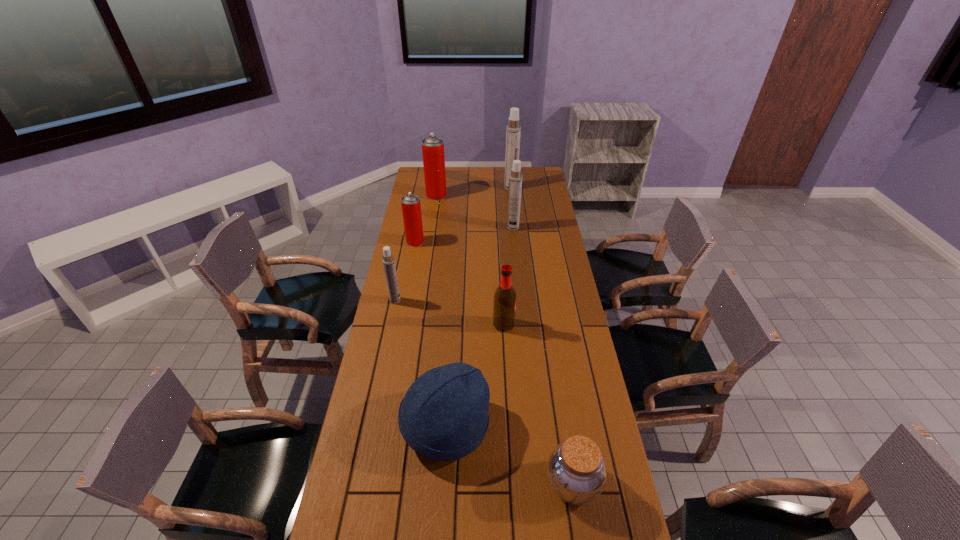
The height and width of the screenshot is (540, 960). What are the coordinates of `vacant area that lies between the nearest white aerosol can and the second smallest white aerosol can` in the screenshot? It's located at (454, 264).

The height and width of the screenshot is (540, 960). Find the location of `free point between the second nearest aerosol can and the sixth object from left to right`. free point between the second nearest aerosol can and the sixth object from left to right is located at coordinates (460, 284).

Identify the location of free space between the smaller red aerosol can and the fifth farthest object. (405, 271).

Image resolution: width=960 pixels, height=540 pixels. I want to click on the third closest object to the jar, so click(x=504, y=307).

Identify the location of object that is the fourth closest to the farther red aerosol can. This screenshot has width=960, height=540. (388, 261).

You are a GUI agent. You are given a task and a screenshot of the screen. Output one action in this format:
    pyautogui.click(x=<x>, y=<y>)
    Task: Click on the aerosol can that can be found as the third closest to the nearest object
    
    Given the screenshot: What is the action you would take?
    pyautogui.click(x=515, y=179)

This screenshot has height=540, width=960. What are the coordinates of `aerosol can that stands as the third closest to the bigger red aerosol can` in the screenshot? It's located at (515, 179).

Locate an element on the screen. white aerosol can that stands as the second closest to the beer bottle is located at coordinates (515, 179).

Choose which white aerosol can is the nearest neighbor to the brown jar. Please provide its 2D coordinates. Your answer should be formatted as a tuple, i.e. [(x, y)], where the tuple contains the x and y coordinates of a point satisfying the conditions above.

[(388, 261)]

Locate an element on the screen. This screenshot has width=960, height=540. free location that satisfies the following two spatial constraints: 1. on the front side of the skullcap; 2. on the left side of the brown jar is located at coordinates coord(442,484).